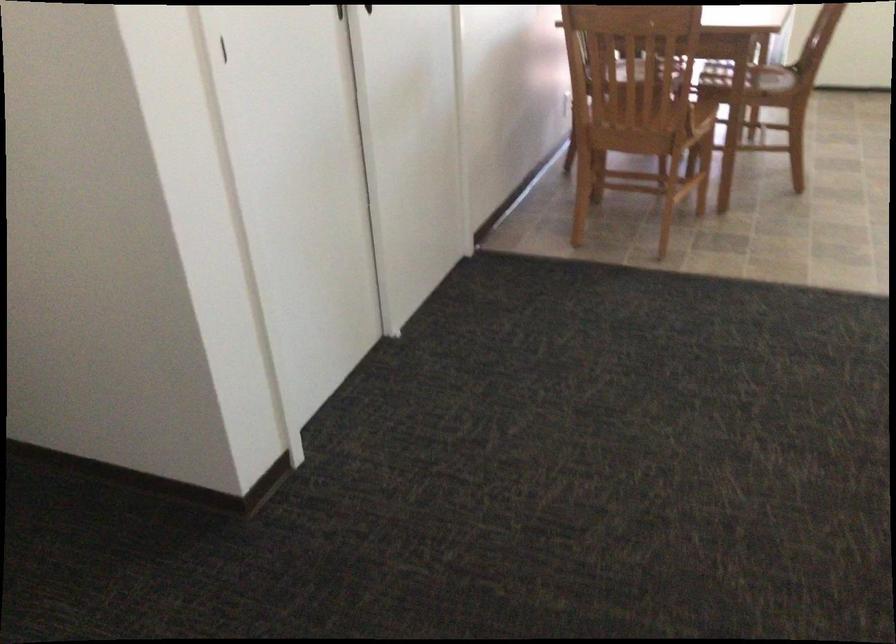
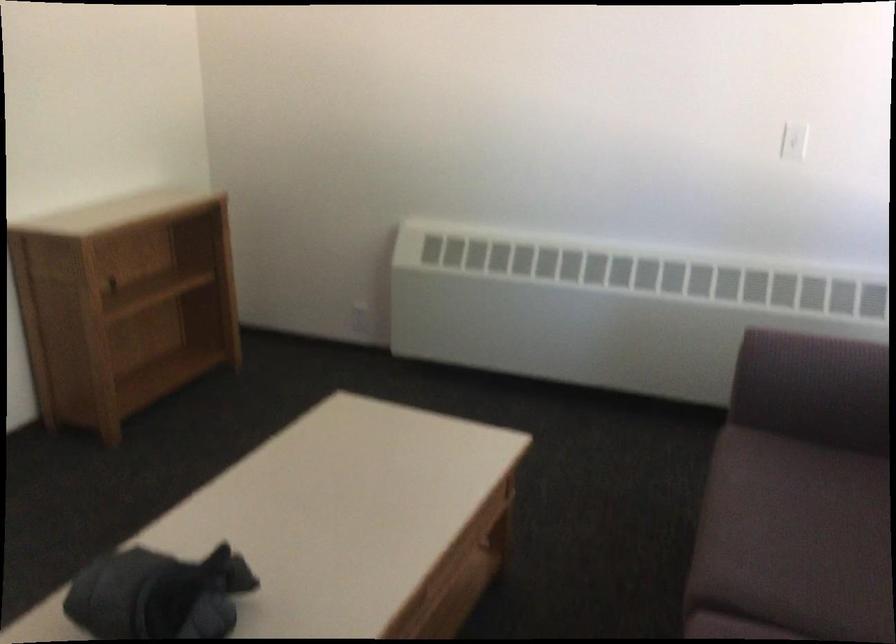
The first image is from the beginning of the video and the second image is from the end. How did the camera likely rotate when shooting the video?

The camera rotated toward right-down.